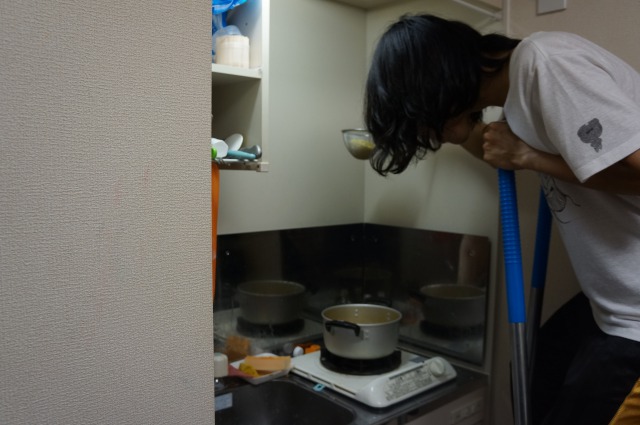
Identify the location of stove dial. (440, 371).